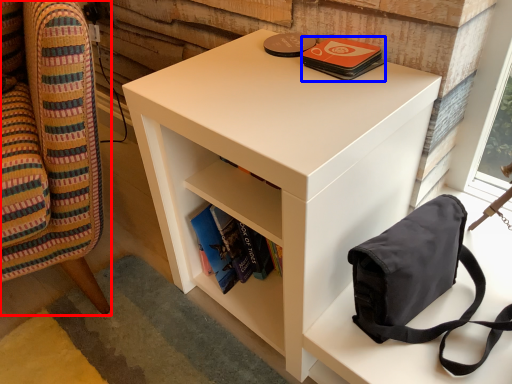
Question: Which object appears closest to the camera in this image, furniture (highlighted by a red box) or paperback book (highlighted by a blue box)?

Choices:
 (A) furniture
 (B) paperback book

Answer: (A)